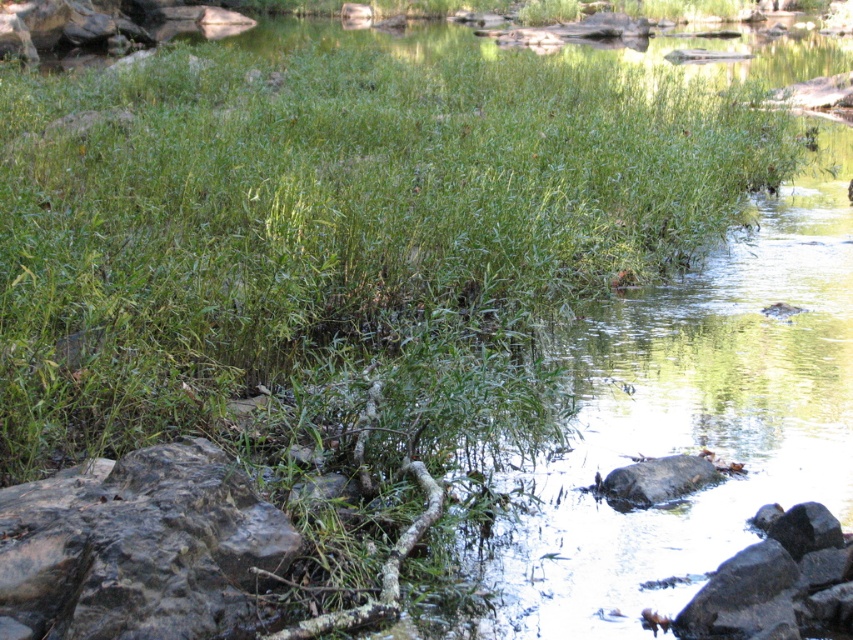
Who is more distant from viewer, (801,621) or (651,486)?

Positioned behind is point (651,486).

Can you confirm if smooth gray rock at lower right is bigger than smooth gray rock at center?

Yes, smooth gray rock at lower right is bigger than smooth gray rock at center.

Between point (798, 602) and point (608, 474), which one is positioned in front?

Point (798, 602)

At what (x,y) coordinates should I click in order to perform the action: click on smooth gray rock at lower right. Please return your answer as a coordinate pair (x, y). Looking at the image, I should click on (778, 580).

Does gray rough rock at lower left have a greater height compared to smooth gray rock at center?

Yes.

Does gray rough rock at lower left appear over smooth gray rock at center?

Indeed, gray rough rock at lower left is positioned over smooth gray rock at center.

Find the location of a particular element. gray rough rock at lower left is located at coordinates (140, 547).

Does gray rough rock at lower left appear over smooth gray rock at lower right?

Indeed, gray rough rock at lower left is positioned over smooth gray rock at lower right.

Which of these two, gray rough rock at lower left or smooth gray rock at lower right, stands shorter?

With less height is smooth gray rock at lower right.

Is point (244, 525) positioned behind point (729, 627)?

Yes, point (244, 525) is behind point (729, 627).

The image size is (853, 640). I want to click on gray rough rock at lower left, so [140, 547].